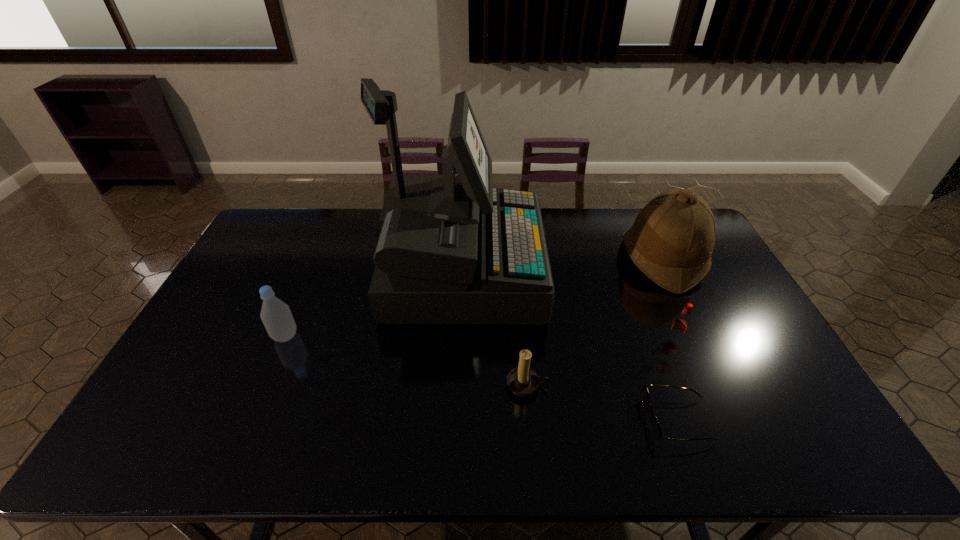
The height and width of the screenshot is (540, 960). I want to click on cash register, so click(x=452, y=250).

Where is `hat`? The height and width of the screenshot is (540, 960). hat is located at coordinates pyautogui.click(x=671, y=241).

Find the location of a particular element. This screenshot has height=540, width=960. the fourth shortest object is located at coordinates (276, 315).

At what (x,y) coordinates should I click in order to perform the action: click on the leftmost object. Please return your answer as a coordinate pair (x, y). Looking at the image, I should click on (276, 315).

Locate an element on the screen. This screenshot has height=540, width=960. root beer is located at coordinates (680, 326).

You are a GUI agent. You are given a task and a screenshot of the screen. Output one action in this format:
    pyautogui.click(x=<x>, y=<y>)
    Task: Click on the candle holder
    The image size is (960, 540).
    Given the screenshot: What is the action you would take?
    pyautogui.click(x=523, y=381)

This screenshot has width=960, height=540. Find the location of `spectacles`. spectacles is located at coordinates (655, 427).

Identify the location of free region located 0.390m on the customer-facing side of the tallest object. (659, 272).

Locate an element on the screen. This screenshot has width=960, height=540. vacant space positioned on the front-facing side of the hat is located at coordinates (520, 259).

Where is `vacant position located 0.260m on the front-facing side of the hat`? vacant position located 0.260m on the front-facing side of the hat is located at coordinates (546, 259).